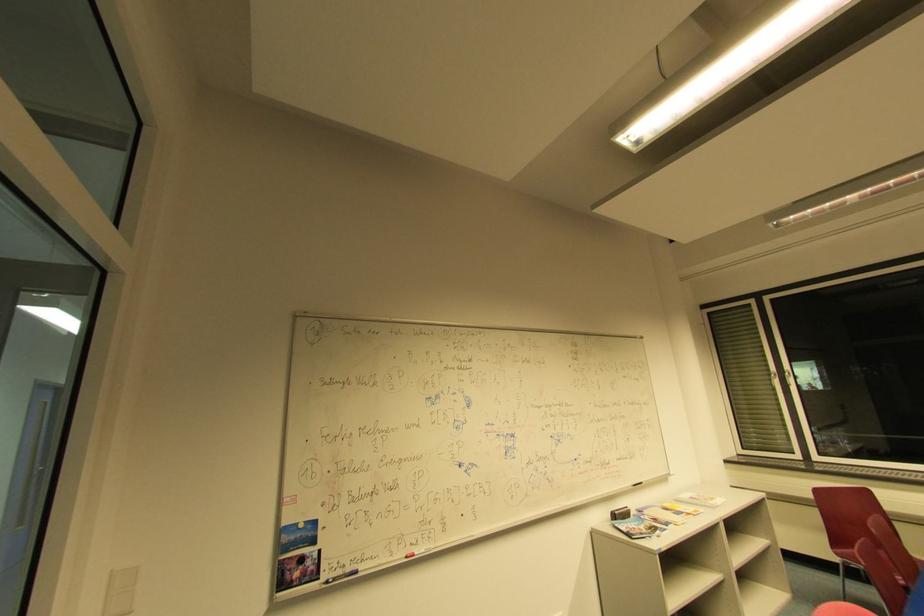
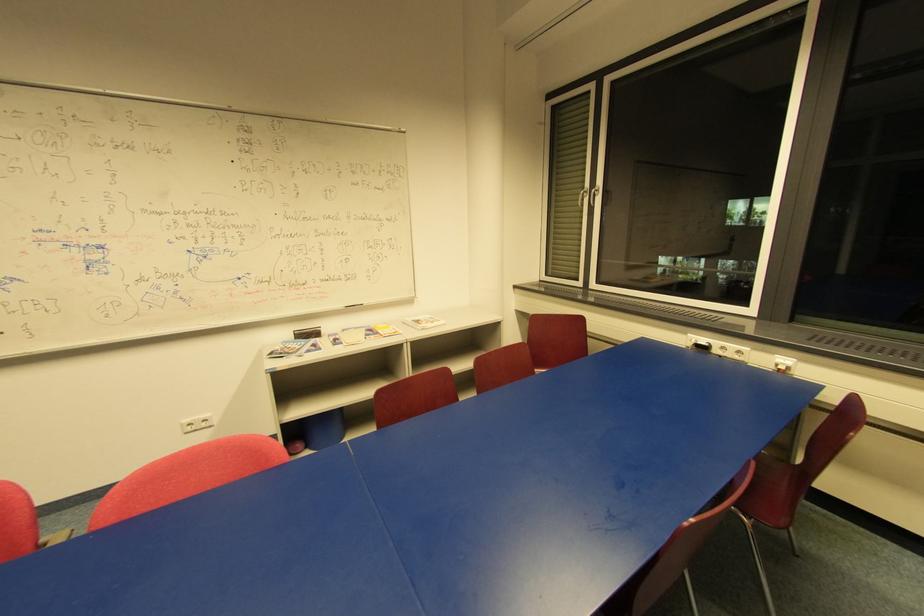
Locate, in the second image, the point that corresponds to the point at 631,485 in the first image.

(344, 307)